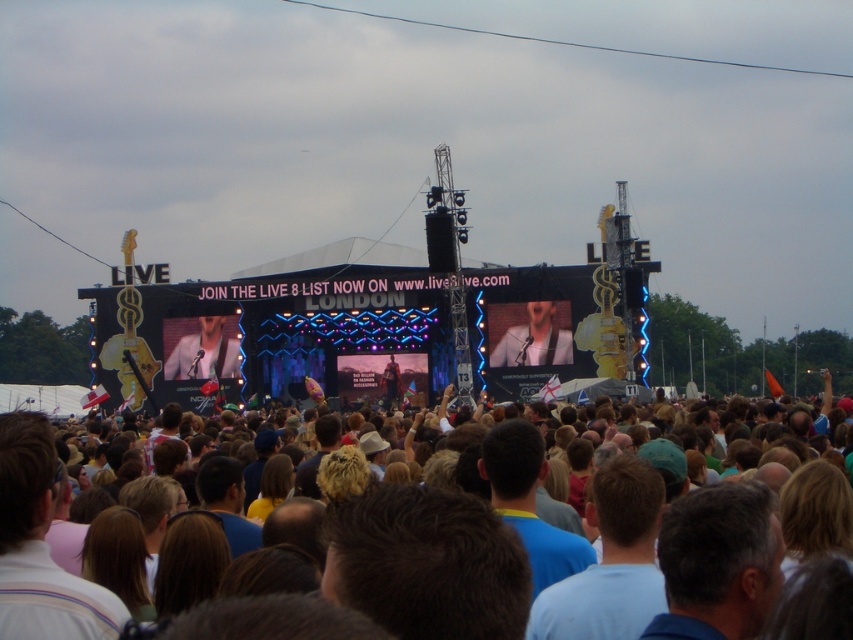
Can you confirm if brown hair at center is wider than matte black jacket at center?

Indeed, brown hair at center has a greater width compared to matte black jacket at center.

Does brown hair at center come in front of matte black jacket at center?

Yes, it is in front of matte black jacket at center.

Is point (618, 570) less distant than point (196, 317)?

Yes, it is.

Locate an element on the screen. This screenshot has width=853, height=640. brown hair at center is located at coordinates (648, 531).

Which of these two, brown hair at center or matte white shirt at center, stands shorter?

With less height is matte white shirt at center.

Is brown hair at center positioned before matte white shirt at center?

Yes, brown hair at center is in front of matte white shirt at center.

Which is behind, point (639, 616) or point (488, 356)?

The point (488, 356) is behind.

Image resolution: width=853 pixels, height=640 pixels. Identify the location of brown hair at center. (648, 531).

Is point (512, 337) positioned before point (184, 369)?

Yes, point (512, 337) is closer to viewer.

Is point (489, 307) farther from camera compared to point (239, 358)?

No.

Between point (515, 321) and point (192, 348), which one is positioned behind?

The point (192, 348) is behind.

At what (x,y) coordinates should I click in order to perform the action: click on matte white shirt at center. Please return your answer as a coordinate pair (x, y). This screenshot has width=853, height=640. Looking at the image, I should click on click(x=531, y=333).